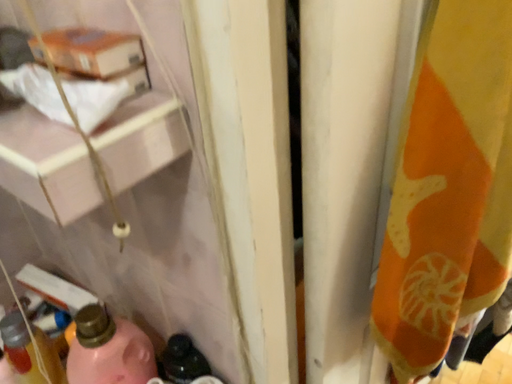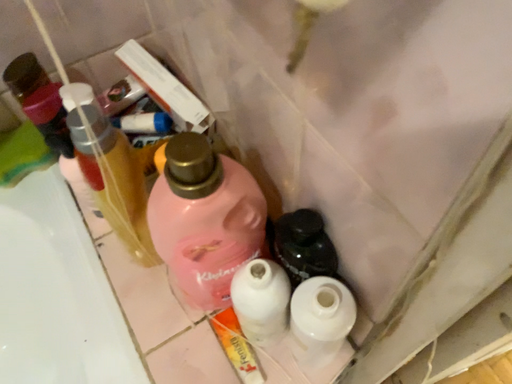
Question: Which way did the camera rotate in the video?

Choices:
 (A) rotated downward
 (B) rotated upward

Answer: (A)